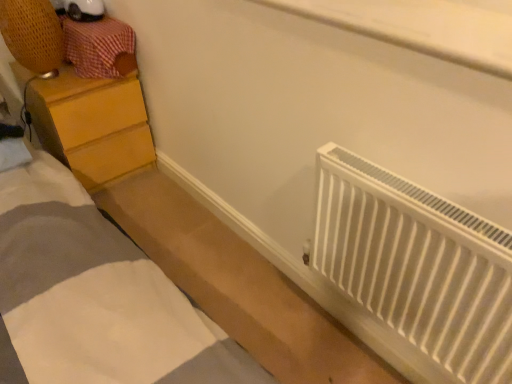
Question: Should I look upward or downward to see white plastic radiator at lower right?

Choices:
 (A) down
 (B) up

Answer: (A)

Question: Is white matte bed at lower right positioned with its back to wooden chest of drawers at left?

Choices:
 (A) yes
 (B) no

Answer: (B)

Question: Are white matte bed at lower right and wooden chest of drawers at left far apart?

Choices:
 (A) no
 (B) yes

Answer: (A)

Question: Is the depth of white matte bed at lower right less than that of wooden chest of drawers at left?

Choices:
 (A) yes
 (B) no

Answer: (A)

Question: Considering the relative sizes of white matte bed at lower right and wooden chest of drawers at left in the image provided, is white matte bed at lower right wider than wooden chest of drawers at left?

Choices:
 (A) no
 (B) yes

Answer: (B)

Question: Is white matte bed at lower right positioned beyond the bounds of wooden chest of drawers at left?

Choices:
 (A) yes
 (B) no

Answer: (A)

Question: From the image's perspective, would you say white matte bed at lower right is shown under wooden chest of drawers at left?

Choices:
 (A) yes
 (B) no

Answer: (A)

Question: Would you consider wooden chest of drawers at left to be distant from white matte bed at lower right?

Choices:
 (A) no
 (B) yes

Answer: (A)

Question: From a real-world perspective, does wooden chest of drawers at left sit lower than white matte bed at lower right?

Choices:
 (A) yes
 (B) no

Answer: (B)

Question: From the image's perspective, would you say wooden chest of drawers at left is shown under white matte bed at lower right?

Choices:
 (A) no
 (B) yes

Answer: (A)

Question: Considering the relative positions of wooden chest of drawers at left and white matte bed at lower right in the image provided, is wooden chest of drawers at left to the right of white matte bed at lower right from the viewer's perspective?

Choices:
 (A) no
 (B) yes

Answer: (A)

Question: Is the position of wooden chest of drawers at left less distant than that of white matte bed at lower right?

Choices:
 (A) yes
 (B) no

Answer: (B)

Question: From a real-world perspective, does wooden chest of drawers at left stand above white matte bed at lower right?

Choices:
 (A) yes
 (B) no

Answer: (A)

Question: Can you confirm if white matte bed at lower right is taller than white plastic radiator at lower right?

Choices:
 (A) yes
 (B) no

Answer: (B)